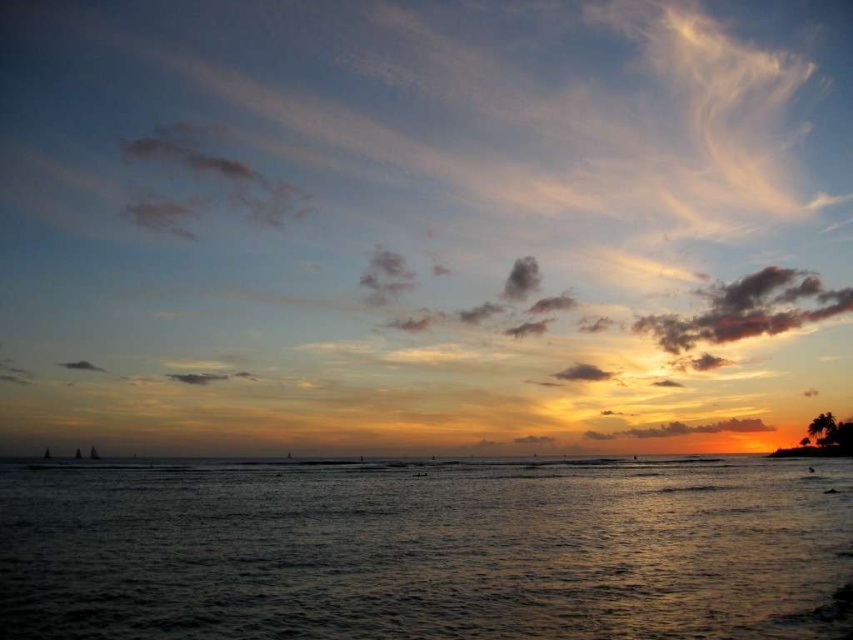
You are an artist trying to paint the sunset scene. You notice the dark water at center and the dark gray textured cloud at upper right. Which one appears wider in the image?

The dark water at center appears wider than the dark gray textured cloud at upper right because its width surpasses that of the cloud.